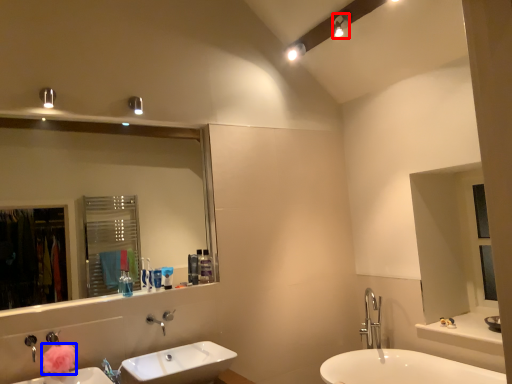
Question: Among these objects, which one is nearest to the camera, light fixture (highlighted by a red box) or flower (highlighted by a blue box)?

Choices:
 (A) light fixture
 (B) flower

Answer: (B)